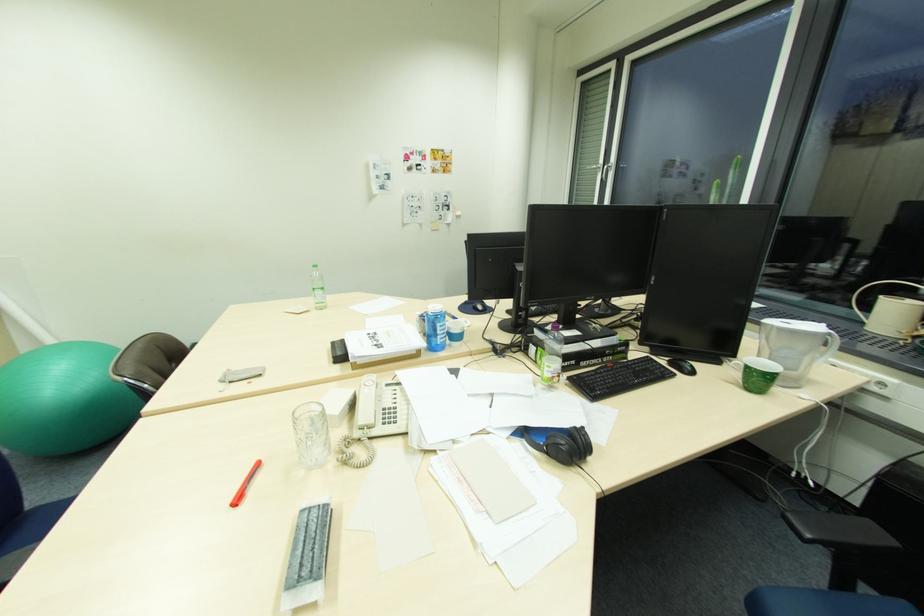
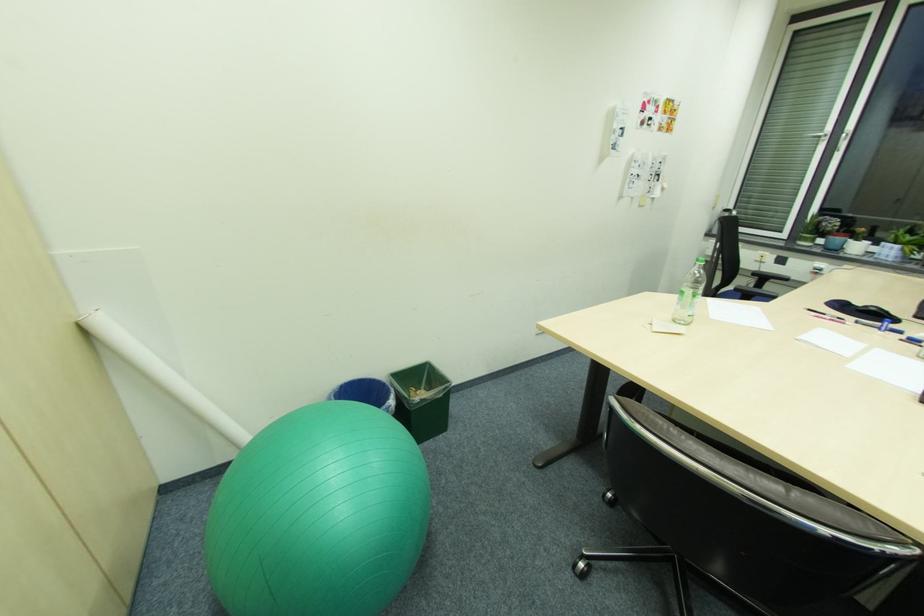
The point at (329,309) is marked in the first image. Where is the corresponding point in the second image?

(688, 323)